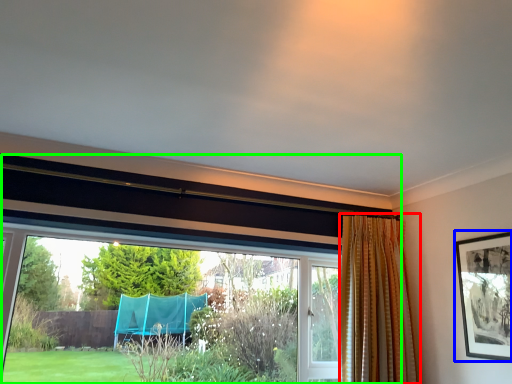
Question: Which object is the closest to the curtain (highlighted by a red box)? Choose among these: picture frame (highlighted by a blue box) or window (highlighted by a green box).

Choices:
 (A) picture frame
 (B) window

Answer: (A)